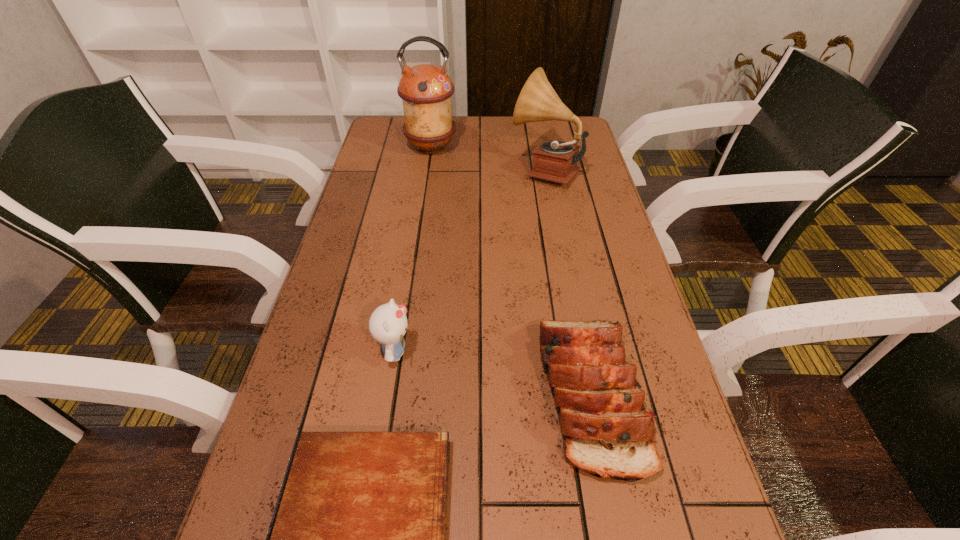
Image resolution: width=960 pixels, height=540 pixels. I want to click on vacant space that is in between the oil lamp and the third shortest object, so click(413, 249).

This screenshot has height=540, width=960. In order to click on vacant space that's between the kitten and the phonograph record in this screenshot , I will do `click(470, 261)`.

This screenshot has width=960, height=540. Find the location of `empty space that is in between the oil lamp and the kitten`. empty space that is in between the oil lamp and the kitten is located at coordinates (413, 249).

What are the coordinates of `vacant space that's between the second tallest object and the bread` in the screenshot? It's located at (567, 283).

Image resolution: width=960 pixels, height=540 pixels. Find the location of `vacant region between the kitten and the oil lamp`. vacant region between the kitten and the oil lamp is located at coordinates (413, 249).

Where is `empty location between the second tallest object and the second shortest object`? This screenshot has height=540, width=960. empty location between the second tallest object and the second shortest object is located at coordinates click(567, 283).

Identify which object is the nearest to the phonograph record. Please provide its 2D coordinates. Your answer should be formatted as a tuple, i.e. [(x, y)], where the tuple contains the x and y coordinates of a point satisfying the conditions above.

[(426, 90)]

Identify which object is the third nearest to the kitten. Please provide its 2D coordinates. Your answer should be formatted as a tuple, i.e. [(x, y)], where the tuple contains the x and y coordinates of a point satisfying the conditions above.

[(556, 161)]

Where is `vacant region that satisfies the following two spatial constraints: 1. on the horn of the second tallest object; 2. on the left side of the fourth tallest object`? vacant region that satisfies the following two spatial constraints: 1. on the horn of the second tallest object; 2. on the left side of the fourth tallest object is located at coordinates (586, 396).

Find the location of a particular element. The image size is (960, 540). vacant space that satisfies the following two spatial constraints: 1. on the horn of the second tallest object; 2. on the back side of the second shortest object is located at coordinates (586, 396).